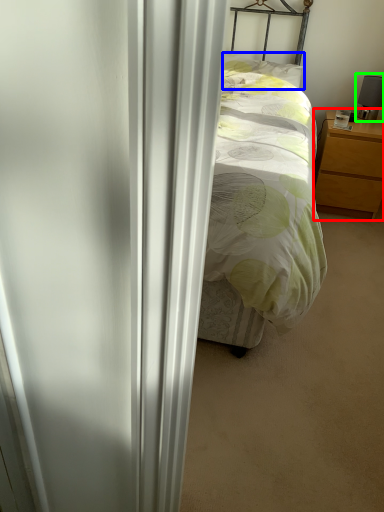
Question: Considering the real-world distances, which object is closest to nightstand (highlighted by a red box)? pillow (highlighted by a blue box) or table lamp (highlighted by a green box).

Choices:
 (A) pillow
 (B) table lamp

Answer: (B)